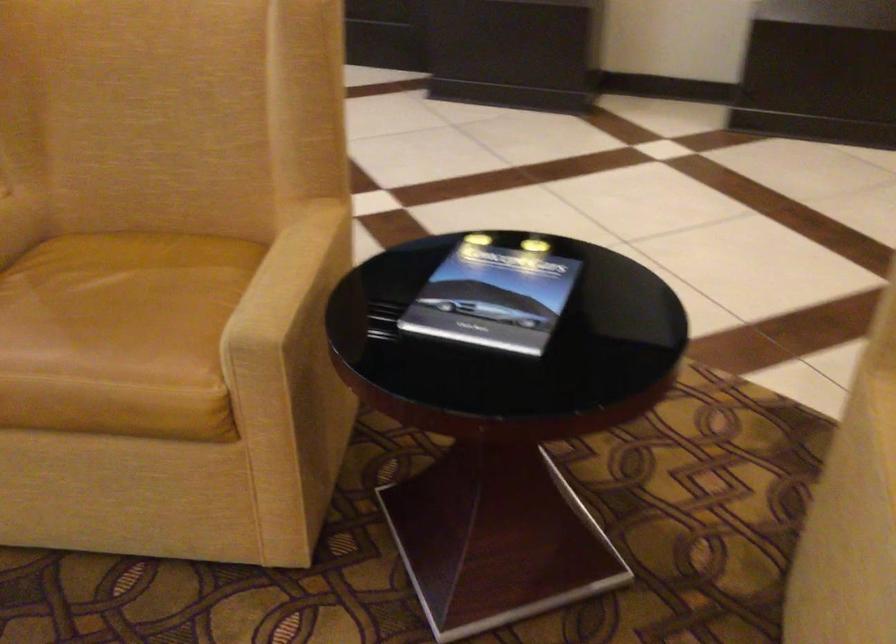
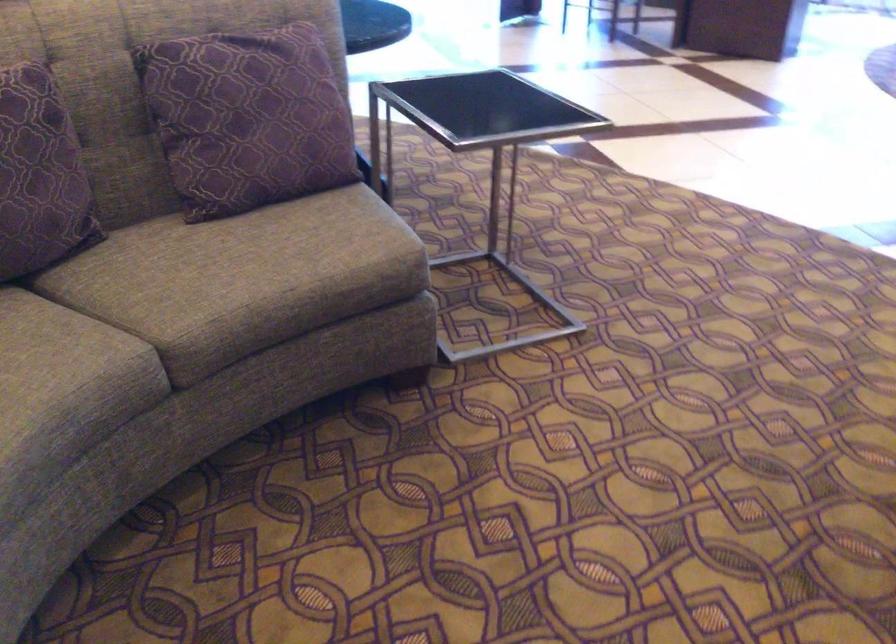
The first image is from the beginning of the video and the second image is from the end. How did the camera likely rotate when shooting the video?

The camera's rotation is toward left-down.